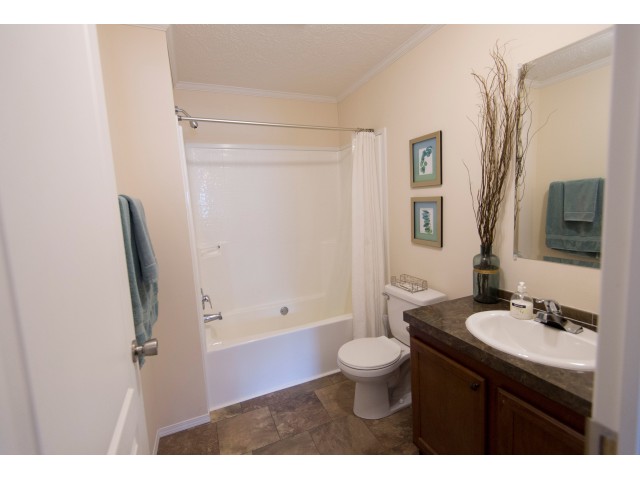
This screenshot has height=480, width=640. Identify the location of curtain. (363, 192).